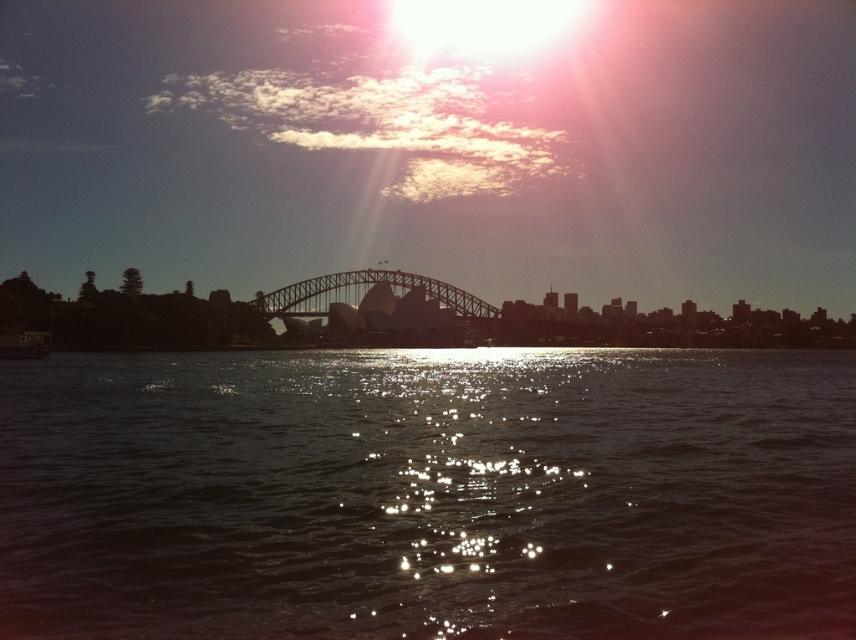
Does glistening water at center have a greater height compared to dark gray metallic bridge at center?

Yes.

Is glistening water at center positioned in front of dark gray metallic bridge at center?

Yes, glistening water at center is in front of dark gray metallic bridge at center.

Image resolution: width=856 pixels, height=640 pixels. Find the location of `glistening water at center`. glistening water at center is located at coordinates (429, 493).

The image size is (856, 640). What are the coordinates of `glistening water at center` in the screenshot? It's located at (429, 493).